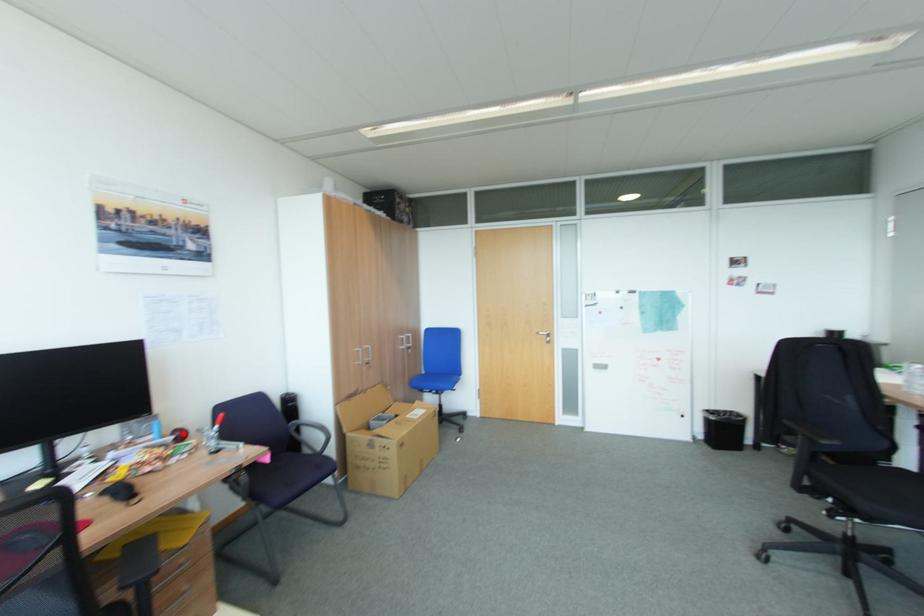
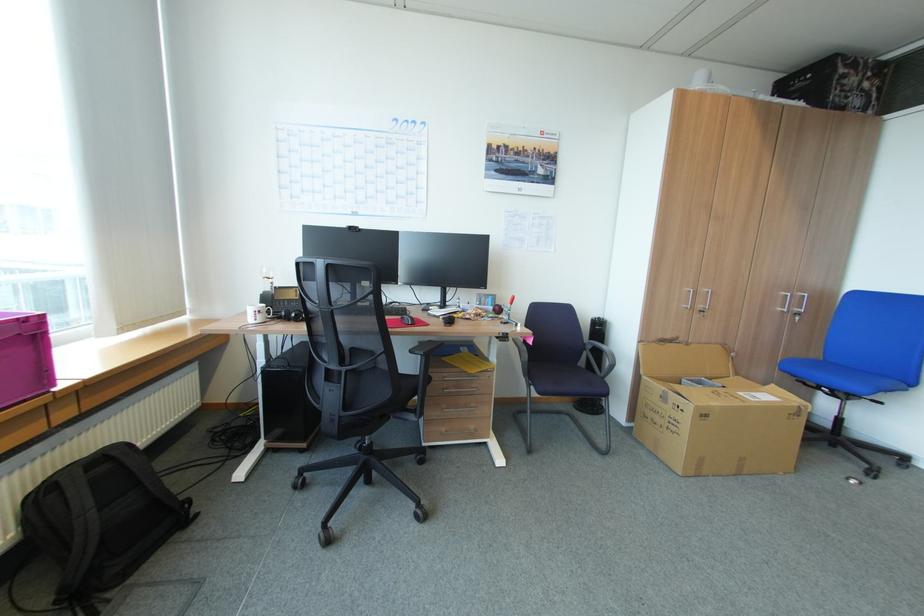
Question: I am providing you with two images of the same scene from different viewpoints. A red point is marked on the first image. Can you still see the location of the red point in image 2?

Choices:
 (A) Yes
 (B) No

Answer: (A)